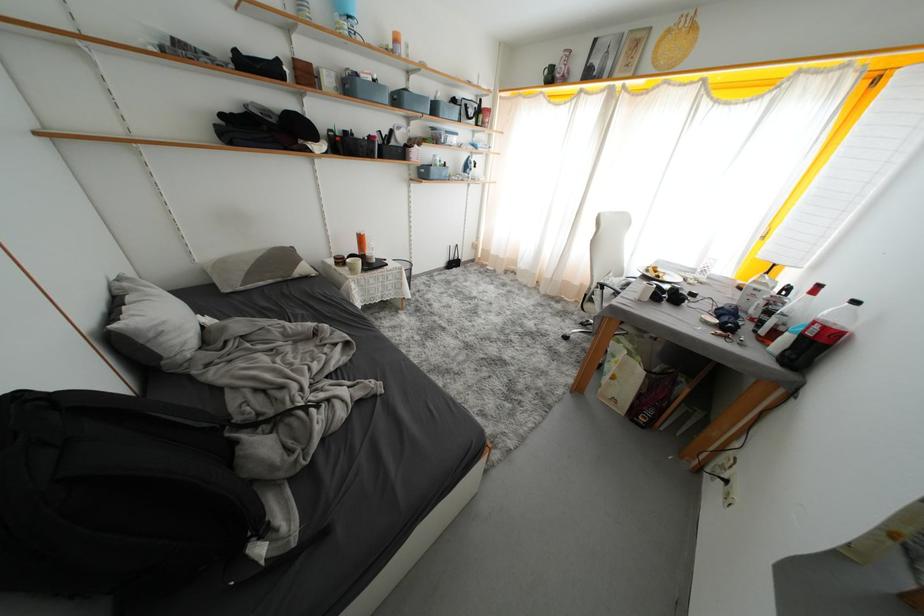
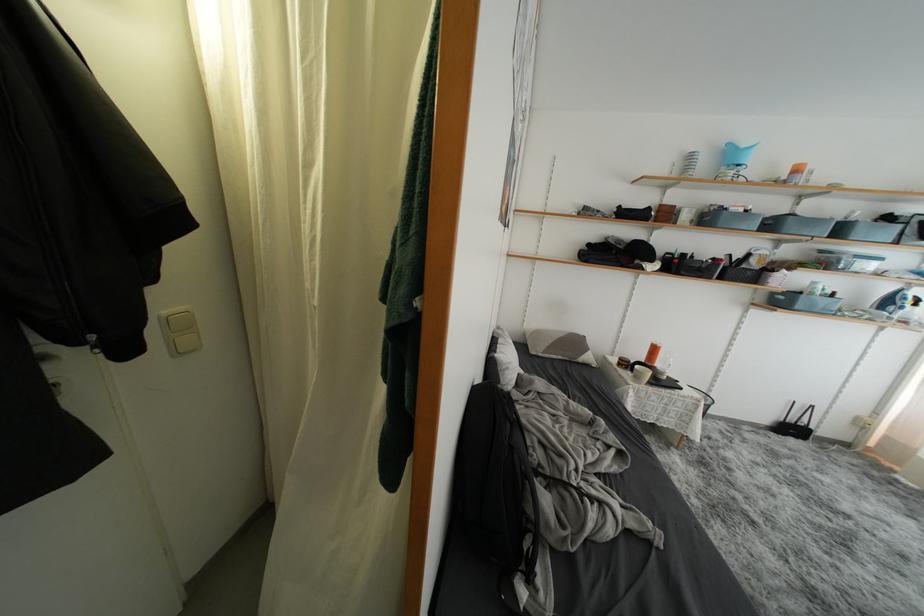
In the second image, find the point that corresponds to (x=439, y=132) in the first image.

(829, 256)